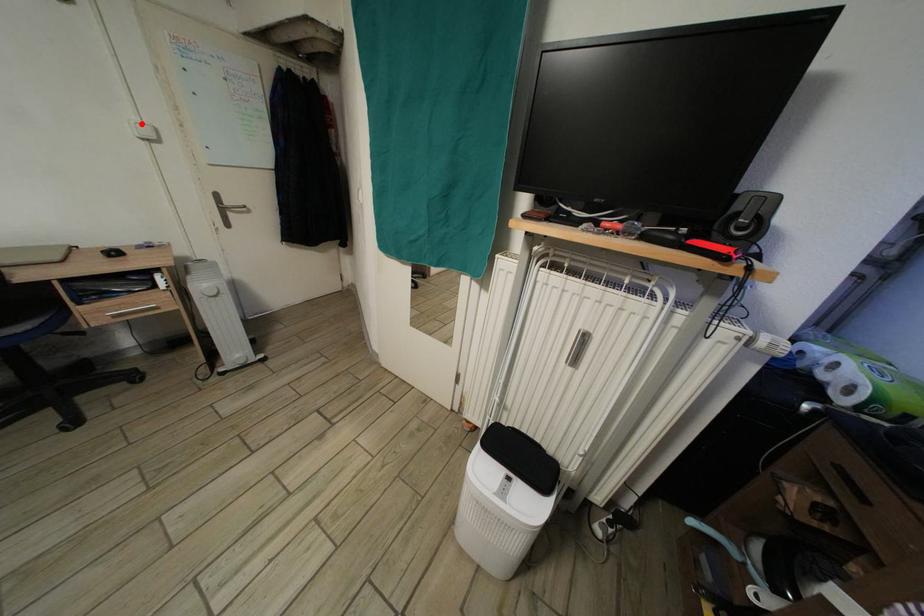
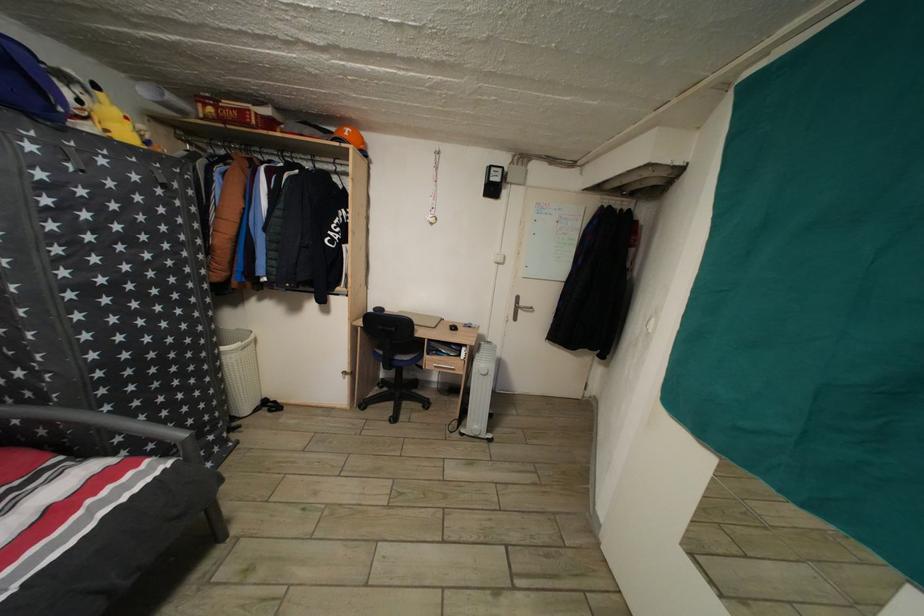
In the second image, find the point that corresponds to the highlighted location in the first image.

(505, 257)